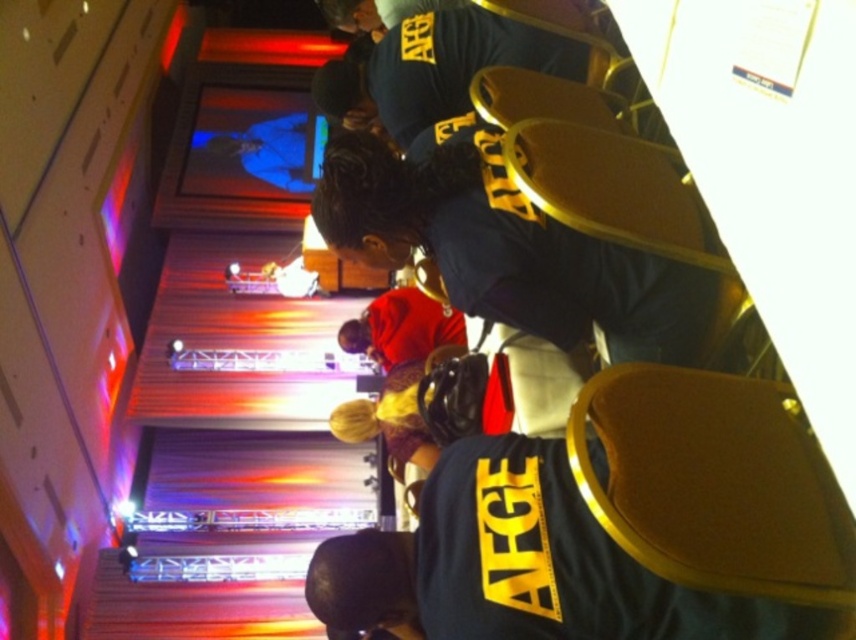
Question: Is dark blue shirt at center behind red velvet jacket at center?

Choices:
 (A) no
 (B) yes

Answer: (A)

Question: Does dark blue shirt at center have a greater width compared to red velvet jacket at center?

Choices:
 (A) no
 (B) yes

Answer: (B)

Question: Which point is farther to the camera?

Choices:
 (A) dark blue shirt at center
 (B) red velvet jacket at center

Answer: (B)

Question: Is dark blue shirt at center above red velvet jacket at center?

Choices:
 (A) no
 (B) yes

Answer: (B)